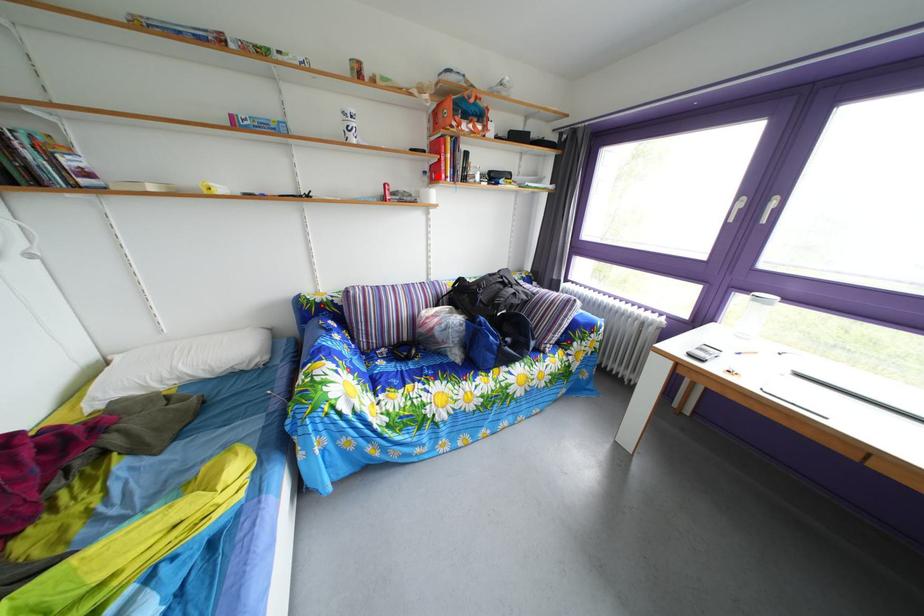
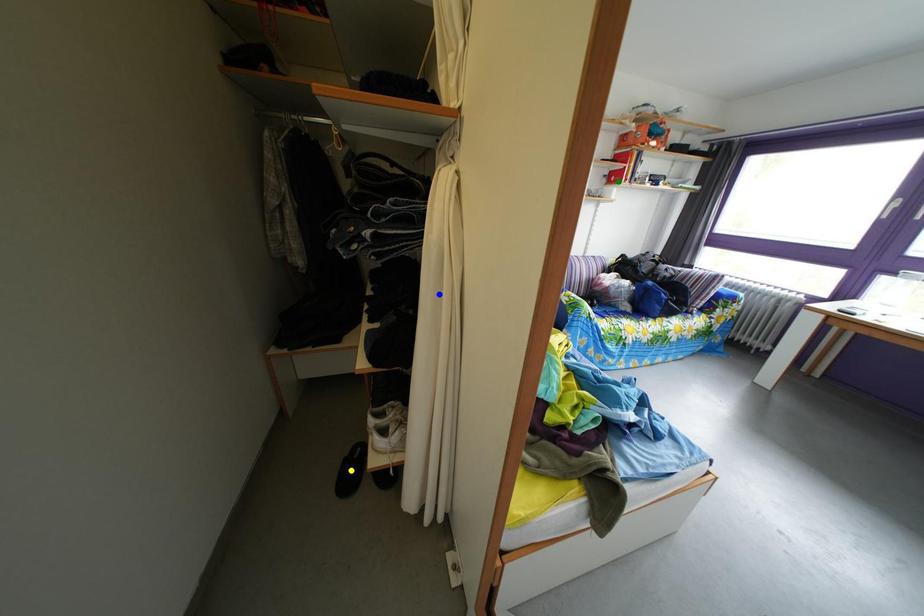
Question: I am providing you with two images of the same scene from different viewpoints. A red point is marked on the first image. You are given multiple points on the second image. Which spot in image 2 lines up with the point in image 1?

Choices:
 (A) yellow point
 (B) green point
 (C) blue point

Answer: (B)